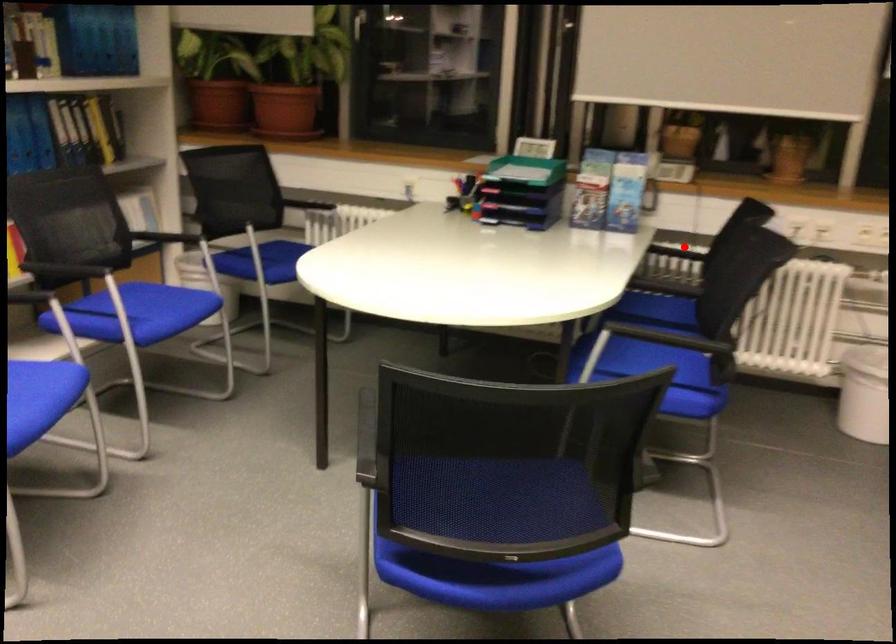
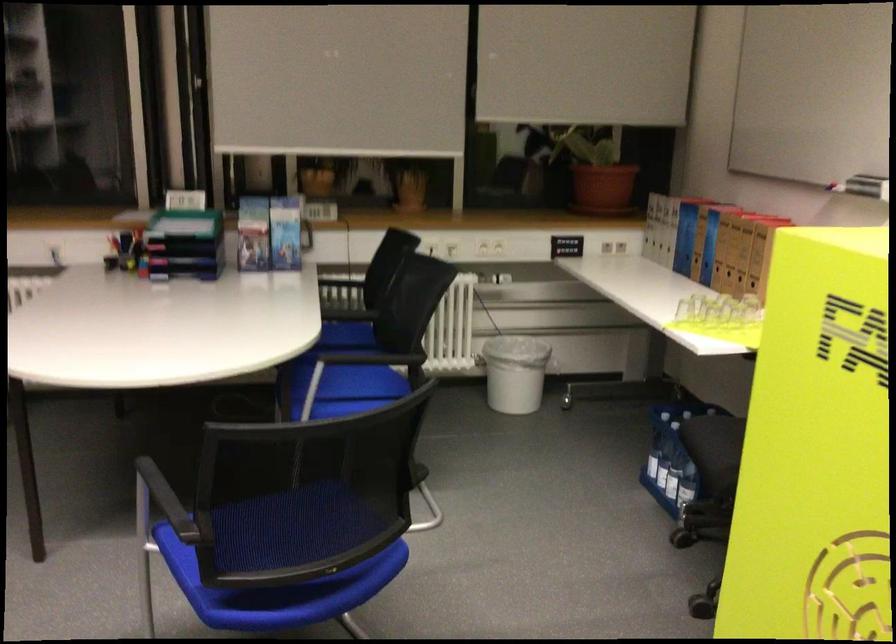
In the second image, find the point that corresponds to the highlighted location in the first image.

(340, 279)